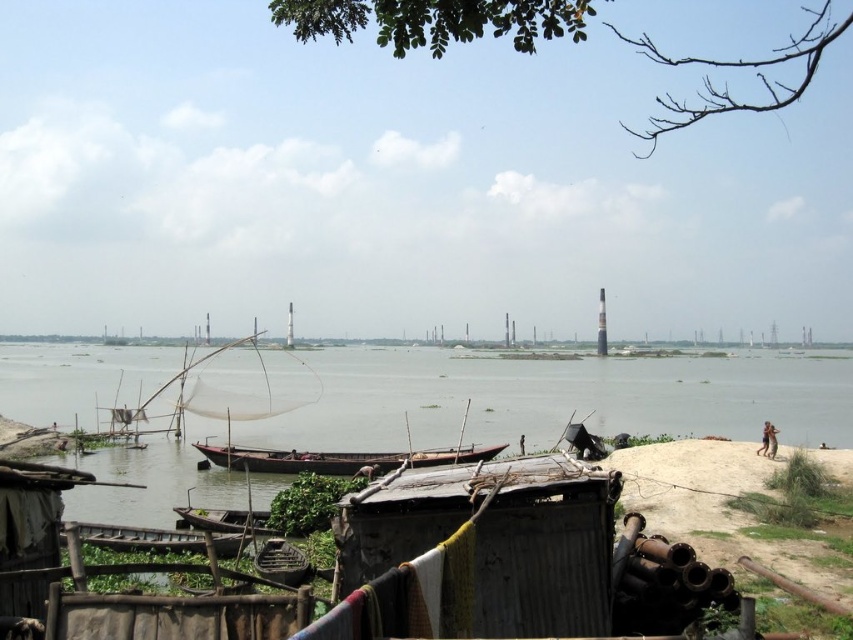
Measure the distance between wooden boat at center and camera.

The distance of wooden boat at center from camera is 22.70 meters.

Describe the element at coordinates (338, 458) in the screenshot. I see `wooden boat at center` at that location.

Does point (212, 451) come behind point (221, 515)?

Yes, it is behind point (221, 515).

You are a GUI agent. You are given a task and a screenshot of the screen. Output one action in this format:
    pyautogui.click(x=<x>, y=<y>)
    Task: Click on the wooden boat at center
    The height and width of the screenshot is (640, 853).
    Given the screenshot: What is the action you would take?
    pyautogui.click(x=338, y=458)

Who is taller, wooden boat at lower left or wooden boat at lower center?

With more height is wooden boat at lower center.

Can you confirm if wooden boat at lower left is smaller than wooden boat at lower center?

Indeed, wooden boat at lower left has a smaller size compared to wooden boat at lower center.

What are the coordinates of `wooden boat at lower left` in the screenshot? It's located at (141, 538).

Measure the distance from wooden boat at center to wooden boat at lower left.

wooden boat at center is 31.96 feet from wooden boat at lower left.

Based on the photo, can you confirm if wooden boat at center is positioned above wooden boat at lower left?

No.

Is point (341, 461) positioned before point (165, 550)?

No, it is behind (165, 550).

This screenshot has height=640, width=853. Identify the location of wooden boat at center. (338, 458).